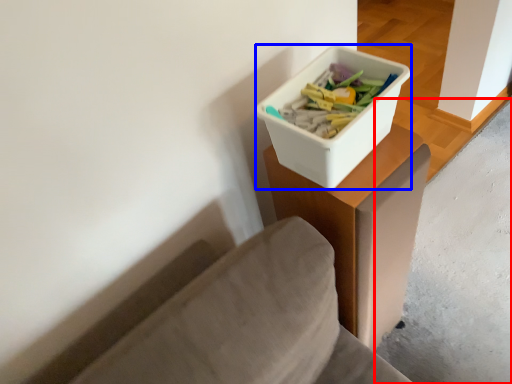
Question: Which object is further to the camera taking this photo, concrete (highlighted by a red box) or storage box (highlighted by a blue box)?

Choices:
 (A) concrete
 (B) storage box

Answer: (A)